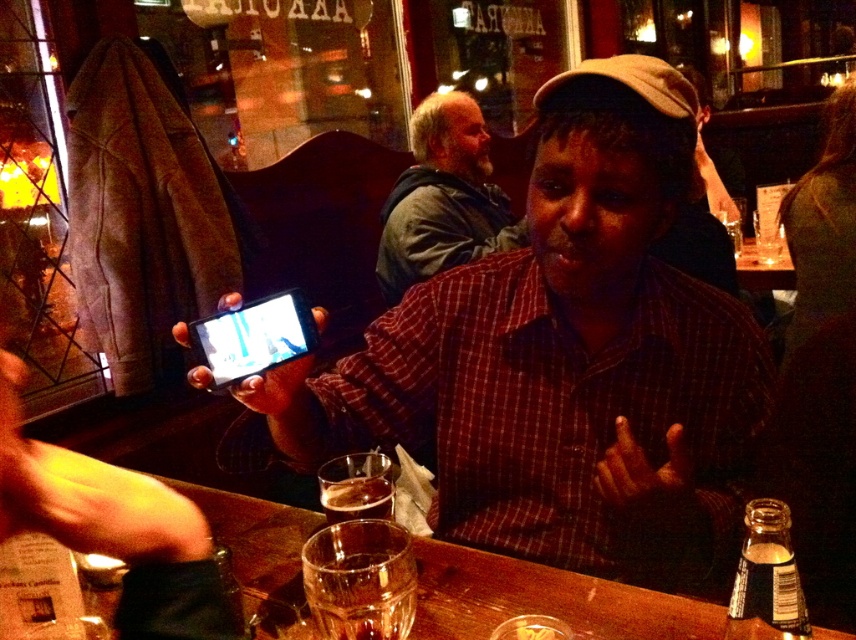
Question: Which point is farther to the camera?

Choices:
 (A) matte black phone at center
 (B) bearded man at center

Answer: (B)

Question: Does matte black phone at center come behind bearded man at center?

Choices:
 (A) yes
 (B) no

Answer: (B)

Question: Considering the real-world distances, which object is closest to the bearded man at center?

Choices:
 (A) matte black phone at center
 (B) transparent glass at lower center

Answer: (A)

Question: Considering the relative positions of matte black phone at center and bearded man at center in the image provided, where is matte black phone at center located with respect to bearded man at center?

Choices:
 (A) below
 (B) above

Answer: (A)

Question: Can you confirm if transparent glass at lower center is wider than bearded man at center?

Choices:
 (A) no
 (B) yes

Answer: (B)

Question: Which object is farther from the camera taking this photo?

Choices:
 (A) bearded man at center
 (B) matte black phone at center
 (C) transparent glass at lower center

Answer: (A)